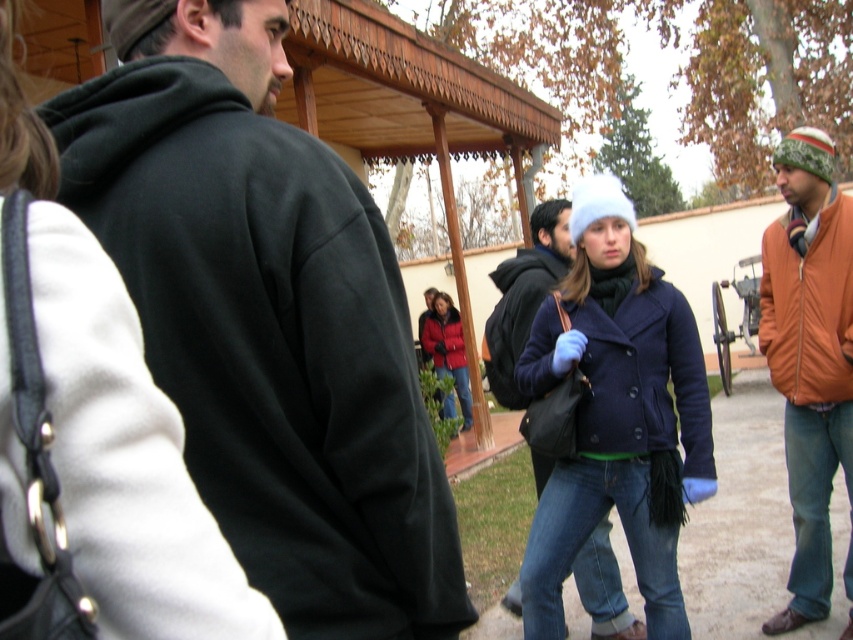
You are standing at the center of the courtyard and want to find the navy blue coat at center. According to the coordinates provided, in which direction should you move to locate it?

The navy blue coat at center is located at coordinates point (616, 413). Since you are at the center, moving towards the lower right direction will help you locate it.

You are standing at the center of the courtyard and want to find the dark green hoodie at center. Which direction should you look to find it?

The dark green hoodie at center is located at the center of the courtyard, so you should look straight ahead to find it.